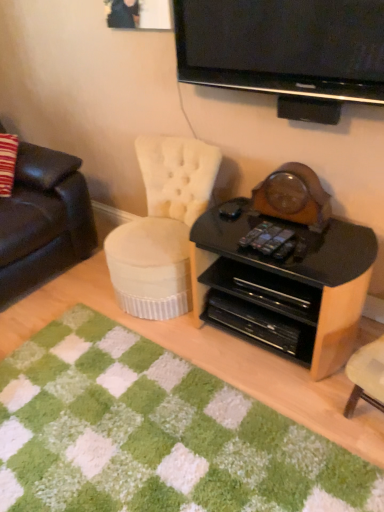
Identify the location of vacant area that lies between white tufted fabric chair at center and black glossy desk at center. (216, 349).